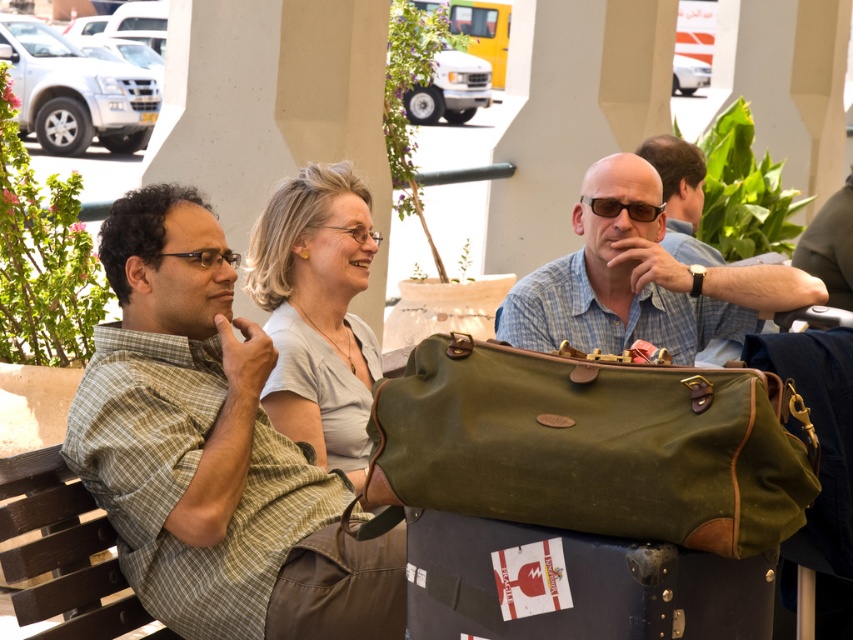
The height and width of the screenshot is (640, 853). Describe the element at coordinates (639, 280) in the screenshot. I see `matte green duffel bag at center` at that location.

Does matte green duffel bag at center have a smaller size compared to matte gray shirt at center?

No, matte green duffel bag at center is not smaller than matte gray shirt at center.

Between point (706, 332) and point (312, 204), which one is positioned behind?

The point (706, 332) is behind.

Where is `matte green duffel bag at center`? Image resolution: width=853 pixels, height=640 pixels. matte green duffel bag at center is located at coordinates click(639, 280).

Does matte green leather suitcase at center come in front of matte gray shirt at center?

That is True.

Is matte green leather suitcase at center below matte gray shirt at center?

Yes, matte green leather suitcase at center is below matte gray shirt at center.

Locate an element on the screen. matte green leather suitcase at center is located at coordinates (575, 586).

Who is shorter, matte green leather suitcase at center or brown wooden park bench at lower left?

matte green leather suitcase at center is shorter.

Where is `matte green leather suitcase at center`? The width and height of the screenshot is (853, 640). matte green leather suitcase at center is located at coordinates (575, 586).

This screenshot has width=853, height=640. What do you see at coordinates (575, 586) in the screenshot?
I see `matte green leather suitcase at center` at bounding box center [575, 586].

Identify the location of matte green leather suitcase at center. (575, 586).